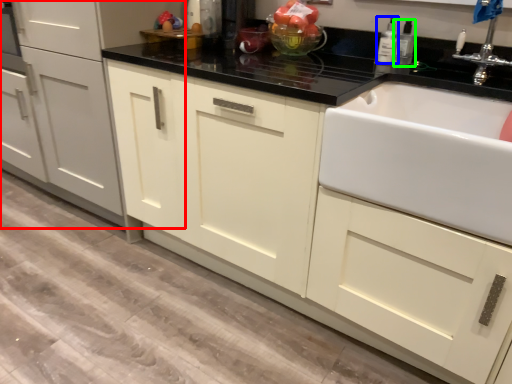
Question: Estimate the real-world distances between objects in this image. Which object is closer to cabinetry (highlighted by a red box), bottle (highlighted by a blue box) or bottle (highlighted by a green box)?

Choices:
 (A) bottle
 (B) bottle

Answer: (A)